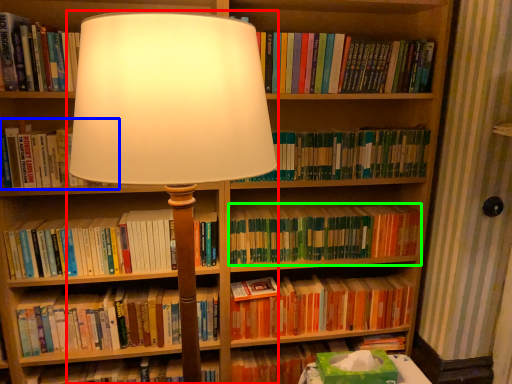
Question: Estimate the real-world distances between objects in this image. Which object is farther from lamp (highlighted by a red box), book (highlighted by a blue box) or book (highlighted by a green box)?

Choices:
 (A) book
 (B) book

Answer: (B)